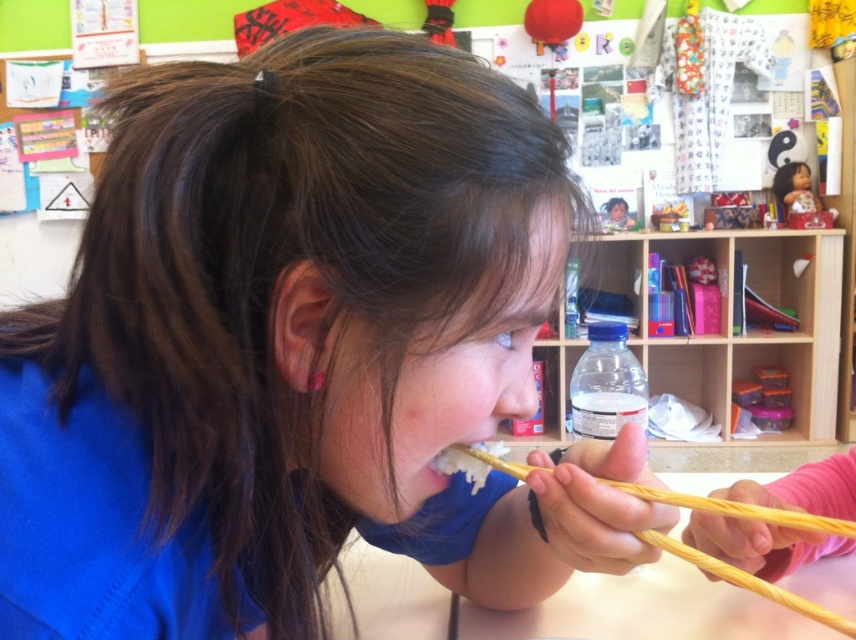
Consider the image. You are a photographer trying to capture a closeup of the smooth skin face at center and the smooth skin face at upper center in the classroom scene. Which face should you focus on first to ensure it appears sharp in the photo?

You should focus on the smooth skin face at center first because it is closer to the viewer than the smooth skin face at upper center, so focusing on it will ensure it appears sharp while the other may be slightly blurred.

You are a photographer standing in front of the classroom scene. You notice two points marked in the image. Which point, point (x=788, y=195) or point (x=794, y=184), is closer to you?

Point (x=788, y=195) is closer to the camera than point (x=794, y=184).

You are a teacher observing a student in the classroom. You notice the wooden chopsticks at lower center and the smooth skin face at upper center. Which object is shorter in height?

The wooden chopsticks at lower center are shorter in height than the smooth skin face at upper center because the wooden chopsticks at lower center is not as tall as smooth skin face at upper center.